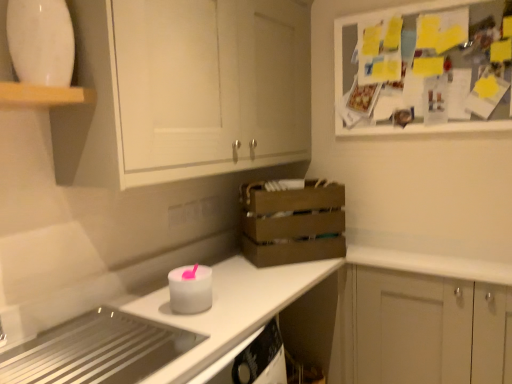
Question: Is point (136, 137) positioned closer to the camera than point (340, 236)?

Choices:
 (A) farther
 (B) closer

Answer: (B)

Question: Choose the correct answer: Is white matte cabinet at upper left, the 2th cabinetry from the bottom, inside brown wooden crate at center or outside it?

Choices:
 (A) inside
 (B) outside

Answer: (B)

Question: Estimate the real-world distances between objects in this image. Which object is closer to the white matte candle at center, placed as the 2th appliance when sorted from top to bottom?

Choices:
 (A) white glossy plate at upper left, the 3th appliance ordered from the bottom
 (B) white glossy countertop at lower left
 (C) metallic stainless steel cooktop at lower left, acting as the 3th appliance starting from the top
 (D) white matte cabinet at upper left, the 1th cabinetry viewed from the left
 (E) white matte cabinet at lower right, which is the first cabinetry in right-to-left order

Answer: (B)

Question: Which object is positioned farthest from the white glossy plate at upper left, marked as the 1th appliance in a top-to-bottom arrangement?

Choices:
 (A) white glossy countertop at lower left
 (B) white matte candle at center, the 2th appliance ordered from the bottom
 (C) white matte cabinet at upper left, placed as the second cabinetry when sorted from right to left
 (D) metallic stainless steel cooktop at lower left, the first appliance when ordered from bottom to top
 (E) white matte cabinet at lower right, which appears as the second cabinetry when viewed from the left

Answer: (E)